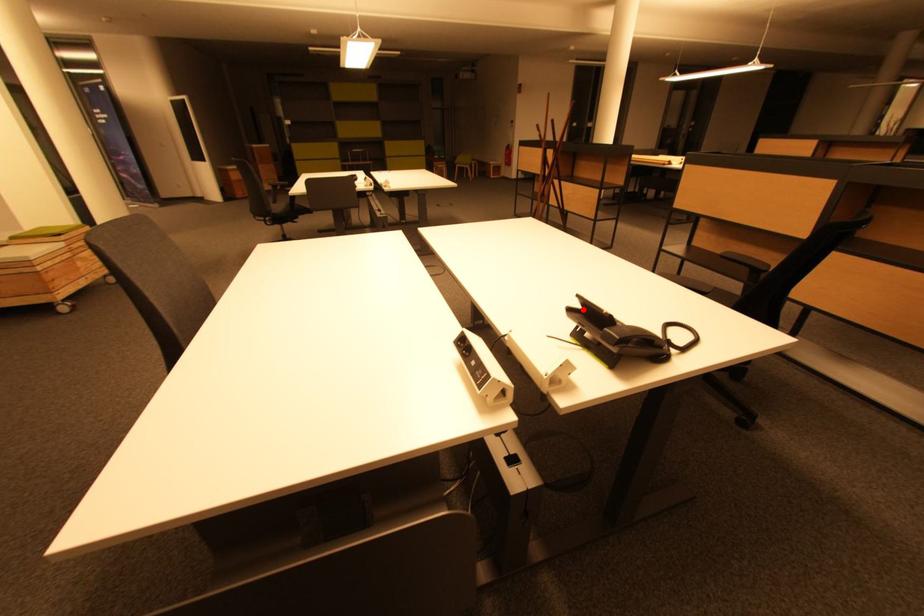
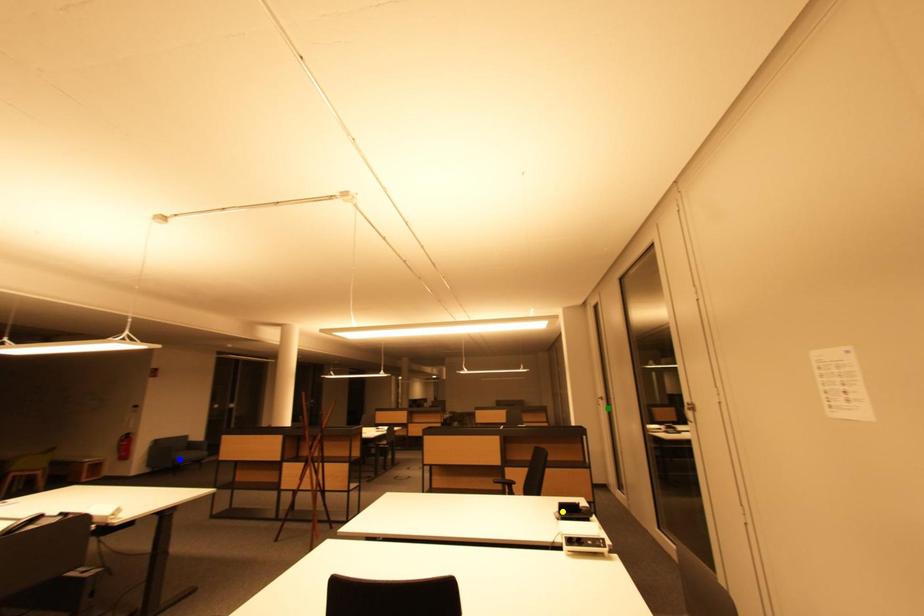
Question: I am providing you with two images of the same scene from different viewpoints. A red point is marked on the first image. You are given multiple points on the second image. Which point in image 2 represents the same 3d spot as the red point in image 1?

Choices:
 (A) yellow point
 (B) blue point
 (C) green point

Answer: (A)